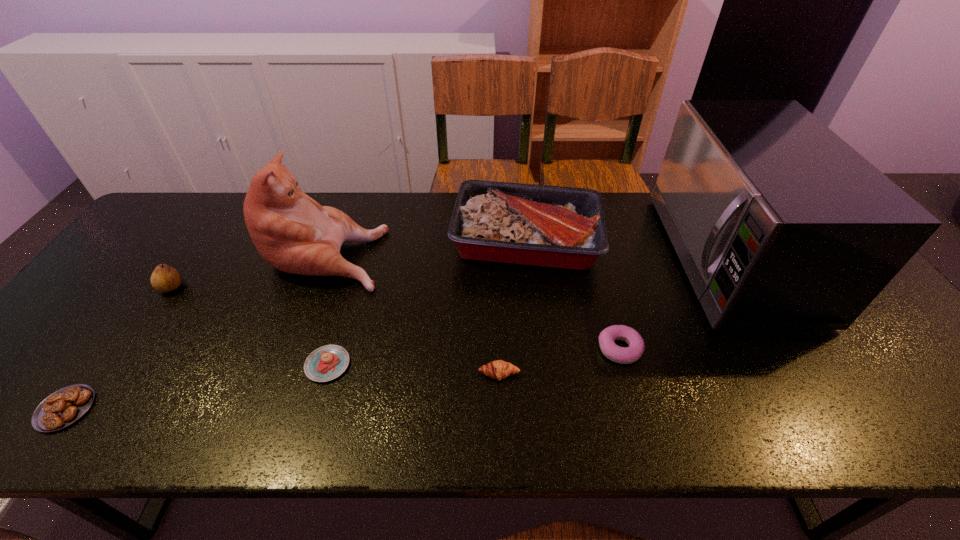
Identify the location of the rightmost object. (779, 224).

You are a GUI agent. You are given a task and a screenshot of the screen. Output one action in this format:
    pyautogui.click(x=<x>, y=<y>)
    Task: Click on the cat
    
    Given the screenshot: What is the action you would take?
    [x=292, y=232]

The width and height of the screenshot is (960, 540). Find the location of `tray`. tray is located at coordinates (551, 226).

Where is `the fourth tallest object`? The width and height of the screenshot is (960, 540). the fourth tallest object is located at coordinates (164, 278).

Locate an element on the screen. The height and width of the screenshot is (540, 960). the rightmost pastry is located at coordinates (624, 355).

Locate an element on the screen. the third pastry from left to right is located at coordinates (498, 369).

Locate an element on the screen. The width and height of the screenshot is (960, 540). the third pastry from right to left is located at coordinates (326, 363).

You are a GUI agent. You are given a task and a screenshot of the screen. Output one action in this format:
    pyautogui.click(x=<x>, y=<y>)
    Task: Click on the nearest object
    
    Given the screenshot: What is the action you would take?
    pyautogui.click(x=65, y=406)

Identify the location of the leftmost pastry. This screenshot has height=540, width=960. (65, 406).

The width and height of the screenshot is (960, 540). Find the location of `free spot located 0.340m with the door open on the microwave oven`. free spot located 0.340m with the door open on the microwave oven is located at coordinates (547, 257).